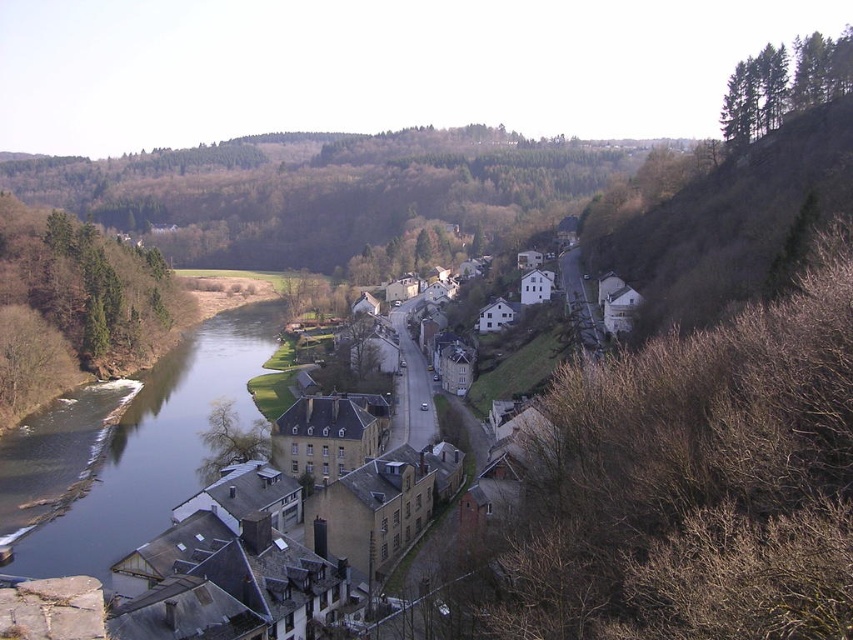
Consider the image. Is smooth concrete river at left smaller than green leafy trees at upper right?

Incorrect, smooth concrete river at left is not smaller in size than green leafy trees at upper right.

Which is in front, point (103, 570) or point (720, 129)?

Point (103, 570)

Where is `smooth concrete river at left`? This screenshot has height=640, width=853. smooth concrete river at left is located at coordinates (157, 445).

Which is more to the left, yellow stone buildings at center or green leafy tree at lower left?

Positioned to the left is green leafy tree at lower left.

The height and width of the screenshot is (640, 853). I want to click on yellow stone buildings at center, so click(303, 536).

Does point (148, 545) lie in front of point (228, 428)?

Yes, point (148, 545) is in front of point (228, 428).

At what (x,y) coordinates should I click in order to perform the action: click on yellow stone buildings at center. Please return your answer as a coordinate pair (x, y). Image resolution: width=853 pixels, height=640 pixels. Looking at the image, I should click on (303, 536).

Is point (688, 419) in front of point (253, 433)?

Yes, point (688, 419) is closer to viewer.

Who is taller, brown leafless tree at lower right or green leafy tree at lower left?

brown leafless tree at lower right is taller.

What do you see at coordinates (698, 481) in the screenshot? The image size is (853, 640). I see `brown leafless tree at lower right` at bounding box center [698, 481].

The image size is (853, 640). Identify the location of brown leafless tree at lower right. (698, 481).